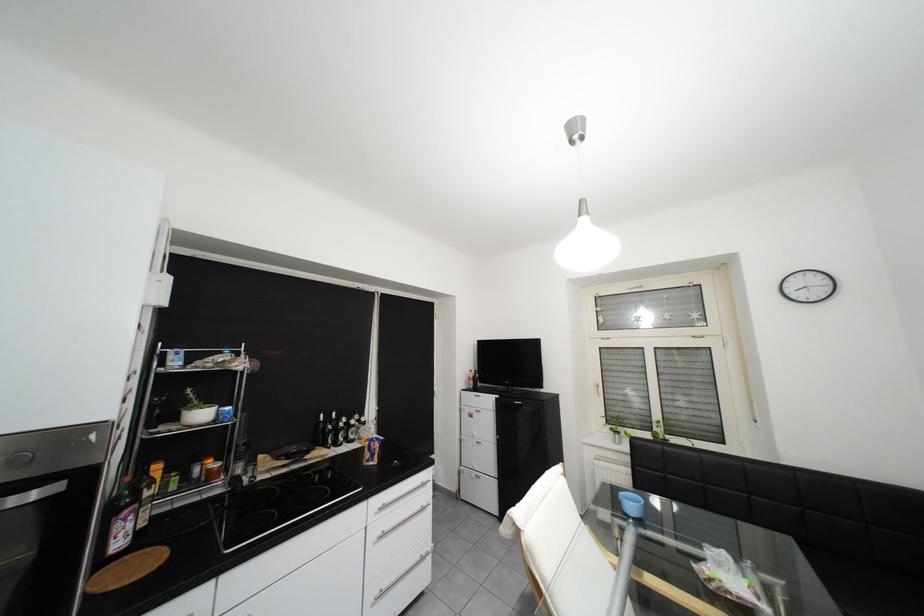
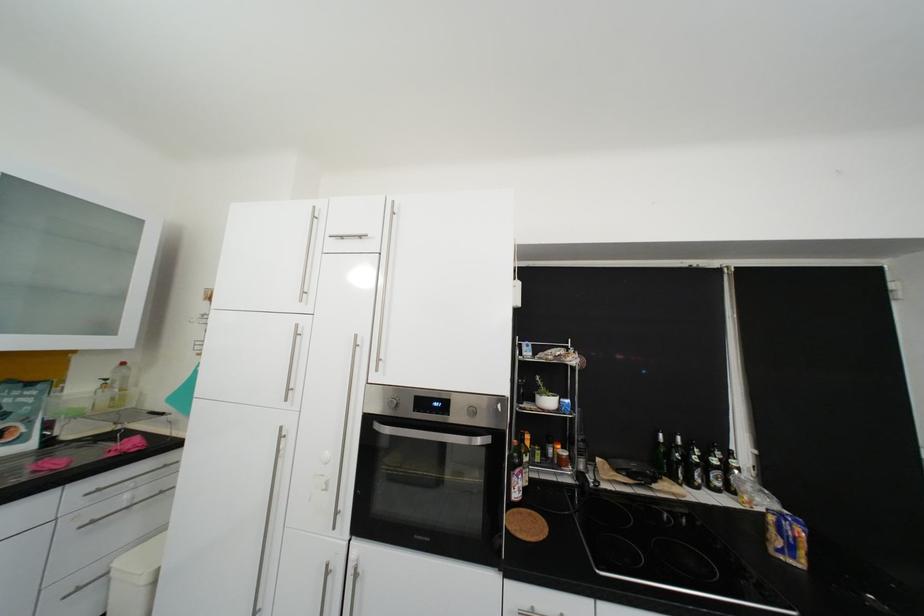
The point at (x=188, y=419) is marked in the first image. Where is the corresponding point in the second image?

(544, 400)